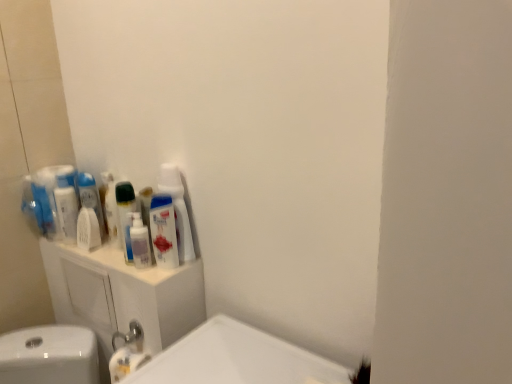
Question: From a real-world perspective, is white glossy bottle at upper center positioned over white plastic cabinet at upper left based on gravity?

Choices:
 (A) no
 (B) yes

Answer: (B)

Question: Considering the relative sizes of white glossy bottle at upper center and white plastic cabinet at upper left in the image provided, is white glossy bottle at upper center thinner than white plastic cabinet at upper left?

Choices:
 (A) no
 (B) yes

Answer: (B)

Question: From the image's perspective, is white glossy bottle at upper center beneath white plastic cabinet at upper left?

Choices:
 (A) yes
 (B) no

Answer: (B)

Question: Can white plastic cabinet at upper left be found inside white glossy bottle at upper center?

Choices:
 (A) yes
 (B) no

Answer: (B)

Question: Can you confirm if white glossy bottle at upper center is smaller than white plastic cabinet at upper left?

Choices:
 (A) no
 (B) yes

Answer: (B)

Question: From the image's perspective, is translucent plastic mouthwash at upper left, the 1th mouthwash viewed from the right, located above or below white glossy bottle at upper center?

Choices:
 (A) below
 (B) above

Answer: (A)

Question: Considering their positions, is translucent plastic mouthwash at upper left, the 1th mouthwash viewed from the right, located in front of or behind white glossy bottle at upper center?

Choices:
 (A) behind
 (B) front

Answer: (B)

Question: Based on their sizes in the image, would you say translucent plastic mouthwash at upper left, the 1th mouthwash viewed from the right, is bigger or smaller than white glossy bottle at upper center?

Choices:
 (A) small
 (B) big

Answer: (A)

Question: Is point (162, 213) closer or farther from the camera than point (182, 226)?

Choices:
 (A) farther
 (B) closer

Answer: (B)

Question: Is white glossy mouthwash at left, which ranks as the 2th mouthwash in left-to-right order, inside the boundaries of translucent plastic mouthwash at upper left, which is the fifth mouthwash in left-to-right order, or outside?

Choices:
 (A) inside
 (B) outside

Answer: (B)

Question: From a real-world perspective, is white glossy mouthwash at left, which ranks as the 2th mouthwash in left-to-right order, positioned above or below translucent plastic mouthwash at upper left, the 1th mouthwash viewed from the right?

Choices:
 (A) below
 (B) above

Answer: (B)

Question: Visually, is white glossy mouthwash at left, which ranks as the 2th mouthwash in left-to-right order, positioned to the left or to the right of translucent plastic mouthwash at upper left, the 1th mouthwash viewed from the right?

Choices:
 (A) right
 (B) left

Answer: (B)

Question: Considering the positions of white glossy mouthwash at left, which ranks as the 2th mouthwash in left-to-right order, and translucent plastic mouthwash at upper left, the 1th mouthwash viewed from the right, in the image, is white glossy mouthwash at left, which ranks as the 2th mouthwash in left-to-right order, bigger or smaller than translucent plastic mouthwash at upper left, the 1th mouthwash viewed from the right,?

Choices:
 (A) small
 (B) big

Answer: (A)

Question: Is white glossy mouthwash at left, the fourth mouthwash positioned from the right, bigger or smaller than white matte mouthwash at left, placed as the 3th mouthwash when sorted from right to left?

Choices:
 (A) big
 (B) small

Answer: (A)

Question: In the image, is white glossy mouthwash at left, which ranks as the 2th mouthwash in left-to-right order, positioned in front of or behind white matte mouthwash at left, placed as the 3th mouthwash when sorted from right to left?

Choices:
 (A) front
 (B) behind

Answer: (B)